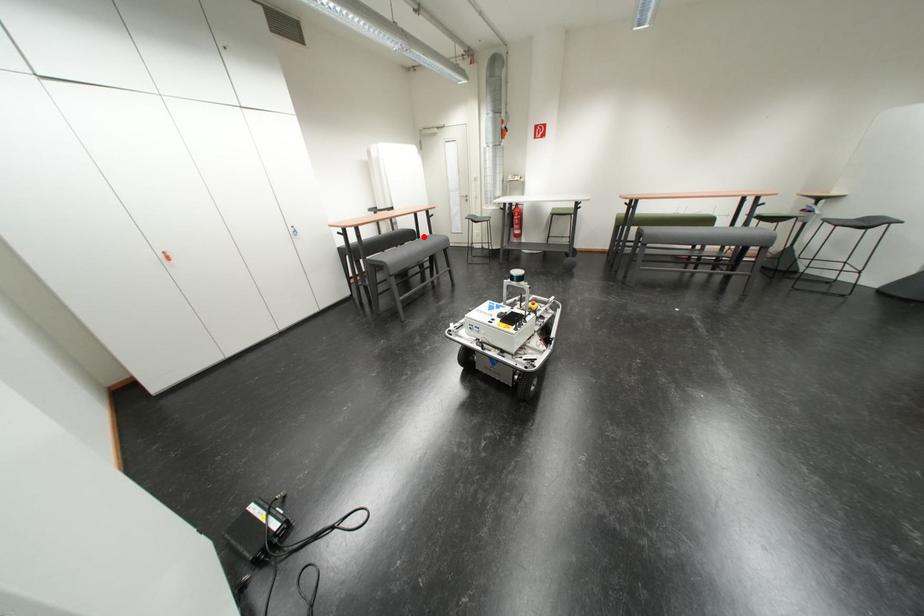
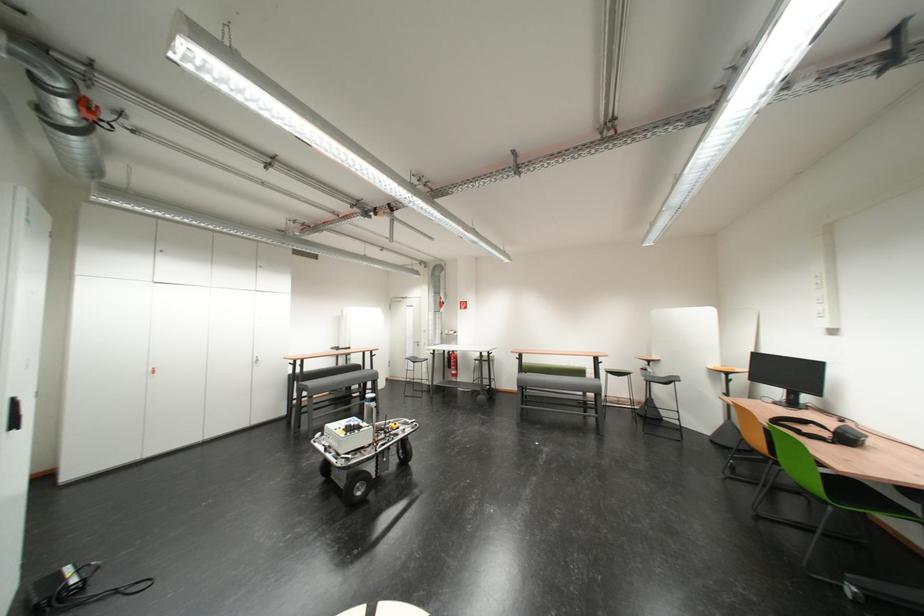
Find the pixel in the second image that matches the highlighted location in the first image.

(369, 371)